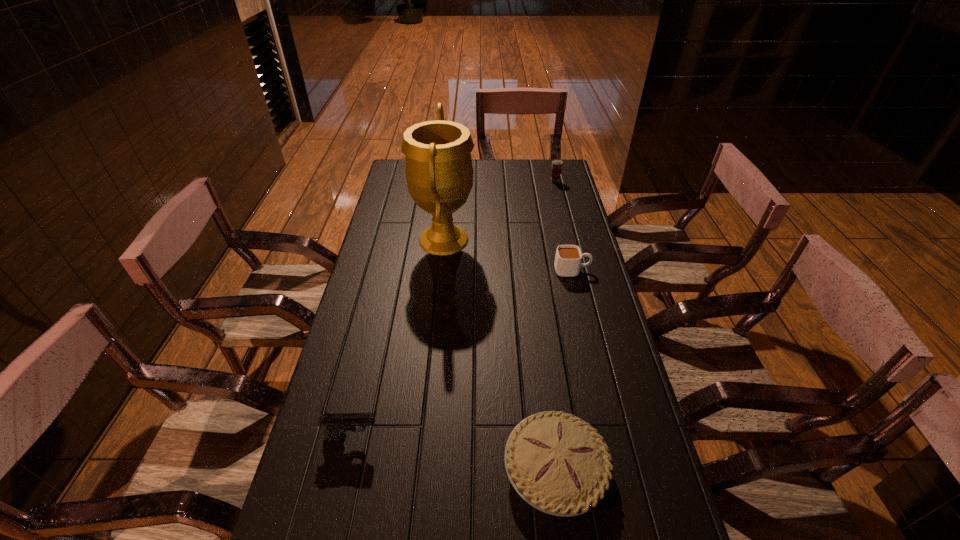
You are a GUI agent. You are given a task and a screenshot of the screen. Output one action in this format:
    pyautogui.click(x=<x>, y=<y>)
    Task: Click on the object that is at the far edge
    Image resolution: width=960 pixels, height=540 pixels.
    Given the screenshot: What is the action you would take?
    pyautogui.click(x=557, y=164)

This screenshot has width=960, height=540. I want to click on trophy present at the left edge, so click(x=438, y=166).

The image size is (960, 540). I want to click on pistol positioned at the left edge, so click(x=336, y=424).

Where is `pie present at the right edge`? The width and height of the screenshot is (960, 540). pie present at the right edge is located at coordinates (558, 463).

Where is `object at the far right corner`? The height and width of the screenshot is (540, 960). object at the far right corner is located at coordinates (557, 164).

Find the location of a particular element. The height and width of the screenshot is (540, 960). free space at the far edge of the desktop is located at coordinates (513, 168).

You are a GUI agent. You are given a task and a screenshot of the screen. Output one action in this format:
    pyautogui.click(x=<x>, y=<y>)
    Task: Click on the free region at the left edge
    This screenshot has width=960, height=540.
    Given the screenshot: What is the action you would take?
    pyautogui.click(x=387, y=228)

Locate an element on the screen. The width and height of the screenshot is (960, 540). vacant region at the right edge of the desktop is located at coordinates tap(577, 198).

This screenshot has height=540, width=960. What are the coordinates of `free space between the pie and the shorter cup` in the screenshot? It's located at (564, 370).

Image resolution: width=960 pixels, height=540 pixels. Identify the location of free space that is in between the tallest object and the pie. (500, 355).